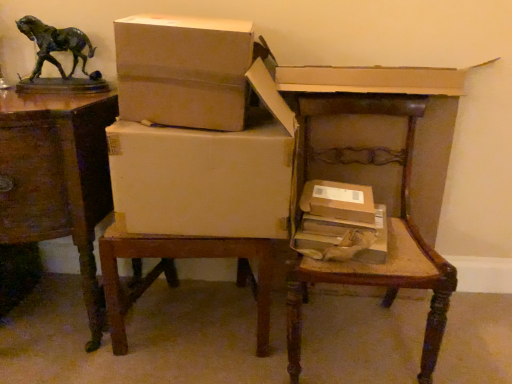
Question: Is white cardboard box at center, the third box when ordered from bottom to top, inside or outside of bronze horse at upper left?

Choices:
 (A) outside
 (B) inside

Answer: (A)

Question: From a real-world perspective, relative to bronze horse at upper left, is white cardboard box at center, which appears as the second box when viewed from the top, vertically above or below?

Choices:
 (A) below
 (B) above

Answer: (A)

Question: Which of these objects is positioned closest to the brown cardboard box at center, which is counted as the 3th box, starting from the top?

Choices:
 (A) brown cardboard box at lower right, the fourth box viewed from the top
 (B) white cardboard box at center, placed as the fourth box when sorted from bottom to top
 (C) wooden table at left
 (D) white cardboard box at center, which appears as the second box when viewed from the top
 (E) wooden chair at center

Answer: (A)

Question: Considering the real-world distances, which object is closest to the wooden table at left?

Choices:
 (A) brown cardboard box at center, which is counted as the 3th box, starting from the top
 (B) white cardboard box at center, the first box in the top-to-bottom sequence
 (C) wooden chair at center
 (D) white cardboard box at center, which appears as the second box when viewed from the top
 (E) brown cardboard box at lower right, arranged as the 1th box when ordered from the bottom

Answer: (D)